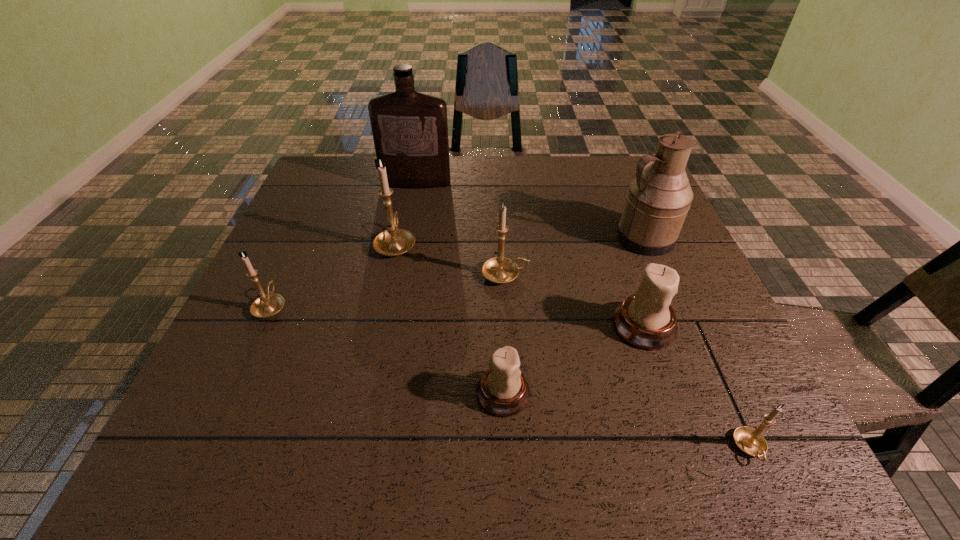
At what (x,y) coordinates should I click in order to perform the action: click on vacant point located between the bigger white candle holder and the leftmost object. Please return your answer as a coordinate pair (x, y). The height and width of the screenshot is (540, 960). Looking at the image, I should click on (457, 316).

Where is `empty location between the sixth shortest object and the second farthest candle holder`? empty location between the sixth shortest object and the second farthest candle holder is located at coordinates (450, 259).

Locate an element on the screen. This screenshot has height=540, width=960. vacant area between the second farthest candle holder and the leftmost gold candle holder is located at coordinates (388, 291).

The width and height of the screenshot is (960, 540). Identify the location of vacant area that lies between the tallest candle holder and the bigger white candle holder. (519, 285).

This screenshot has width=960, height=540. In order to click on object that ranks as the third closest to the rightmost gold candle holder in this screenshot , I will do `click(659, 198)`.

Where is `the second closest object to the farther white candle holder`? This screenshot has height=540, width=960. the second closest object to the farther white candle holder is located at coordinates (751, 441).

Find the location of a particular element. This screenshot has height=540, width=960. candle holder identified as the fifth closest to the liquor is located at coordinates (503, 391).

Point out which candle holder is positioned as the fourth nearest to the liquor. Please provide its 2D coordinates. Your answer should be formatted as a tuple, i.e. [(x, y)], where the tuple contains the x and y coordinates of a point satisfying the conditions above.

[(646, 320)]

Choose which gold candle holder is the fourth nearest neighbor to the liquor. Please provide its 2D coordinates. Your answer should be formatted as a tuple, i.e. [(x, y)], where the tuple contains the x and y coordinates of a point satisfying the conditions above.

[(751, 441)]

Locate an element on the screen. gold candle holder that is the fourth nearest to the bigger white candle holder is located at coordinates (267, 305).